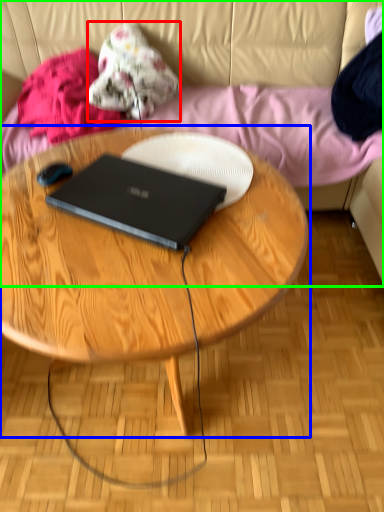
Question: Which object is the closest to the clothing (highlighted by a red box)? Choose among these: coffee table (highlighted by a blue box) or studio couch (highlighted by a green box).

Choices:
 (A) coffee table
 (B) studio couch

Answer: (B)